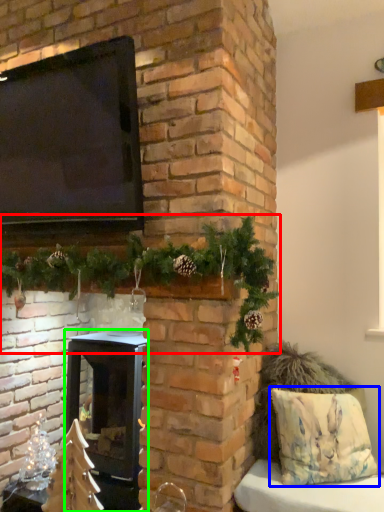
Question: Considering the real-world distances, which object is farthest from christmas decoration (highlighted by a red box)? pillow (highlighted by a blue box) or wood burning stove (highlighted by a green box)?

Choices:
 (A) pillow
 (B) wood burning stove

Answer: (A)